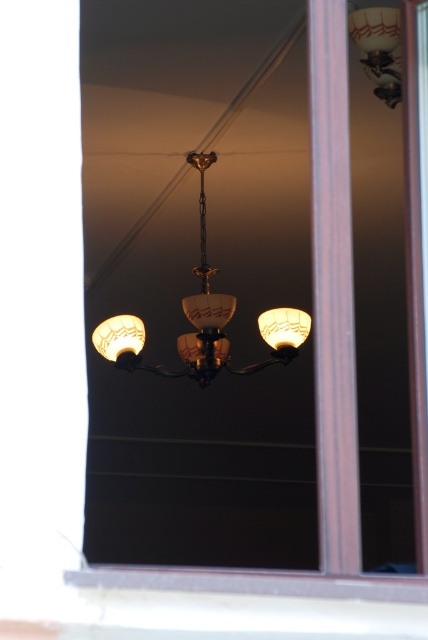
Question: Is the position of brown wood pillar at right more distant than that of translucent glass lampshade at right?

Choices:
 (A) yes
 (B) no

Answer: (B)

Question: Among these points, which one is farthest from the camera?

Choices:
 (A) (318, 42)
 (B) (190, 314)
 (C) (299, 320)
 (D) (134, 352)

Answer: (D)

Question: From the image, what is the correct spatial relationship of matte glass lampshade at center in relation to translucent glass lampshade at right?

Choices:
 (A) right
 (B) left

Answer: (B)

Question: From the image, what is the correct spatial relationship of matte glass lampshade at upper right in relation to translucent glass lampshade at right?

Choices:
 (A) left
 (B) right

Answer: (B)

Question: Which of the following is the farthest from the observer?

Choices:
 (A) matte glass lampshade at center
 (B) matte glass chandelier at center
 (C) matte glass lampshade at upper right

Answer: (A)

Question: Among these points, which one is farthest from the camera?

Choices:
 (A) [121, 332]
 (B) [321, 397]
 (C) [225, 364]
 (D) [272, 316]

Answer: (C)